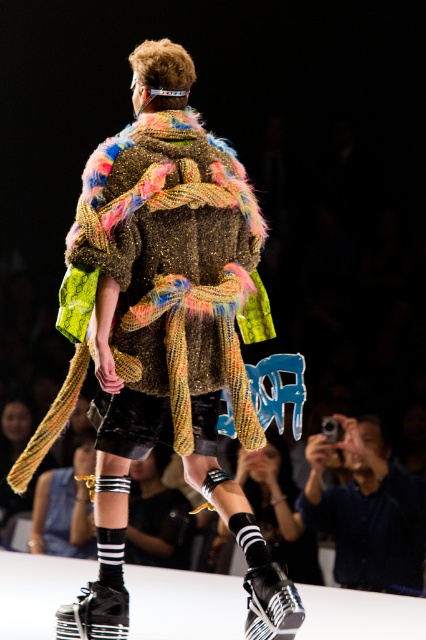
From the picture: You are a fashion designer observing the runway show and need to determine if the fuzzy multicolored coat at center can be displayed on a mannequin that is only 1.5 meters tall. Considering the height of the blue denim shirt at lower right, can the coat be displayed without exceeding the mannequin height?

The fuzzy multicolored coat at center is much taller than the blue denim shirt at lower right. Since the coat is taller, it may exceed the 1.5 meters mannequin height, so it might not fit properly.

You are a fashion designer analyzing the runway image. You notice the fuzzy multicolored coat at center and the blue denim shirt at lower right. Which clothing item is positioned higher in the image?

The fuzzy multicolored coat at center is positioned higher than the blue denim shirt at lower right.

You are a photographer at the runway show and want to focus on both points in the image. Which point, point (189, 301) or point (319, 524), is closer to you?

Point (189, 301) is closer to the camera than point (319, 524).